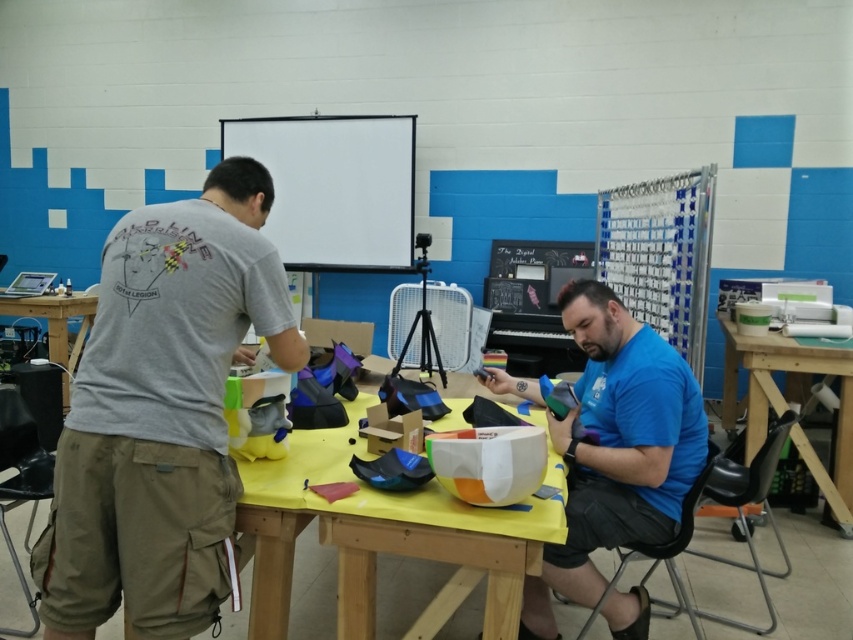
Between gray cotton t-shirt at left and blue matte shirt at center, which one is positioned higher?

Positioned higher is gray cotton t-shirt at left.

Is the position of gray cotton t-shirt at left more distant than that of blue matte shirt at center?

No, gray cotton t-shirt at left is closer to the viewer.

Is point (235, 314) behind point (567, 467)?

No.

Image resolution: width=853 pixels, height=640 pixels. Find the location of `gray cotton t-shirt at left`. gray cotton t-shirt at left is located at coordinates (161, 413).

Can you confirm if green plastic chair at right is shorter than matte black table at left?

No.

Describe the element at coordinates (791, 400) in the screenshot. The height and width of the screenshot is (640, 853). I see `green plastic chair at right` at that location.

Where is `green plastic chair at right`? green plastic chair at right is located at coordinates (791, 400).

Is blue matte shirt at center thinner than yellow matte table at center?

Yes, blue matte shirt at center is thinner than yellow matte table at center.

Can you confirm if blue matte shirt at center is positioned to the right of yellow matte table at center?

Yes, blue matte shirt at center is to the right of yellow matte table at center.

Does point (526, 627) come farther from viewer compared to point (276, 502)?

Yes, it is.

Locate an element on the screen. The height and width of the screenshot is (640, 853). blue matte shirt at center is located at coordinates (616, 449).